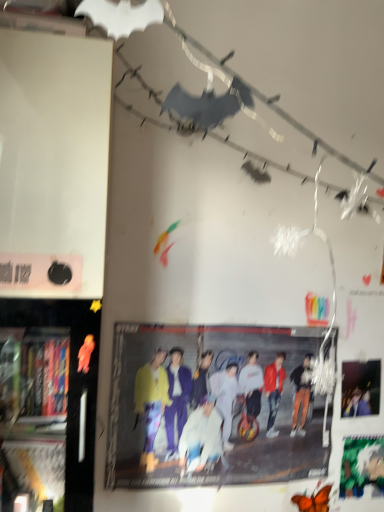
Question: Could you tell me if matte black poster at upper right, the 2th poster page when ordered from bottom to top, is facing black plastic bookshelf at left?

Choices:
 (A) yes
 (B) no

Answer: (B)

Question: From a real-world perspective, is matte black poster at upper right, the 2th poster page when ordered from bottom to top, under black plastic bookshelf at left?

Choices:
 (A) no
 (B) yes

Answer: (B)

Question: Is matte black poster at upper right, the 2th poster page when ordered from bottom to top, shorter than black plastic bookshelf at left?

Choices:
 (A) no
 (B) yes

Answer: (B)

Question: Considering the relative sizes of matte black poster at upper right, the first poster page viewed from the top, and black plastic bookshelf at left in the image provided, is matte black poster at upper right, the first poster page viewed from the top, taller than black plastic bookshelf at left?

Choices:
 (A) yes
 (B) no

Answer: (B)

Question: Considering the relative positions of matte black poster at upper right, the first poster page viewed from the top, and black plastic bookshelf at left in the image provided, is matte black poster at upper right, the first poster page viewed from the top, to the left of black plastic bookshelf at left from the viewer's perspective?

Choices:
 (A) yes
 (B) no

Answer: (B)

Question: Is matte black poster at upper right, the 2th poster page when ordered from bottom to top, far away from black plastic bookshelf at left?

Choices:
 (A) no
 (B) yes

Answer: (B)

Question: Can you confirm if green matte poster at lower right, which is the first poster page from bottom to top, is taller than matte yellow jacket at center?

Choices:
 (A) yes
 (B) no

Answer: (B)

Question: Considering the relative sizes of green matte poster at lower right, which is the first poster page from bottom to top, and matte yellow jacket at center in the image provided, is green matte poster at lower right, which is the first poster page from bottom to top, shorter than matte yellow jacket at center?

Choices:
 (A) no
 (B) yes

Answer: (B)

Question: Considering the relative positions of green matte poster at lower right, arranged as the 2th poster page when viewed from the top, and matte yellow jacket at center in the image provided, is green matte poster at lower right, arranged as the 2th poster page when viewed from the top, to the right of matte yellow jacket at center from the viewer's perspective?

Choices:
 (A) yes
 (B) no

Answer: (A)

Question: Is green matte poster at lower right, arranged as the 2th poster page when viewed from the top, placed right next to matte yellow jacket at center?

Choices:
 (A) yes
 (B) no

Answer: (B)

Question: Is green matte poster at lower right, which is the first poster page from bottom to top, oriented away from matte yellow jacket at center?

Choices:
 (A) no
 (B) yes

Answer: (A)

Question: Is green matte poster at lower right, which is the first poster page from bottom to top, not near matte yellow jacket at center?

Choices:
 (A) yes
 (B) no

Answer: (B)

Question: Is green matte poster at lower right, which is the first poster page from bottom to top, aimed at black plastic bookshelf at left?

Choices:
 (A) no
 (B) yes

Answer: (A)